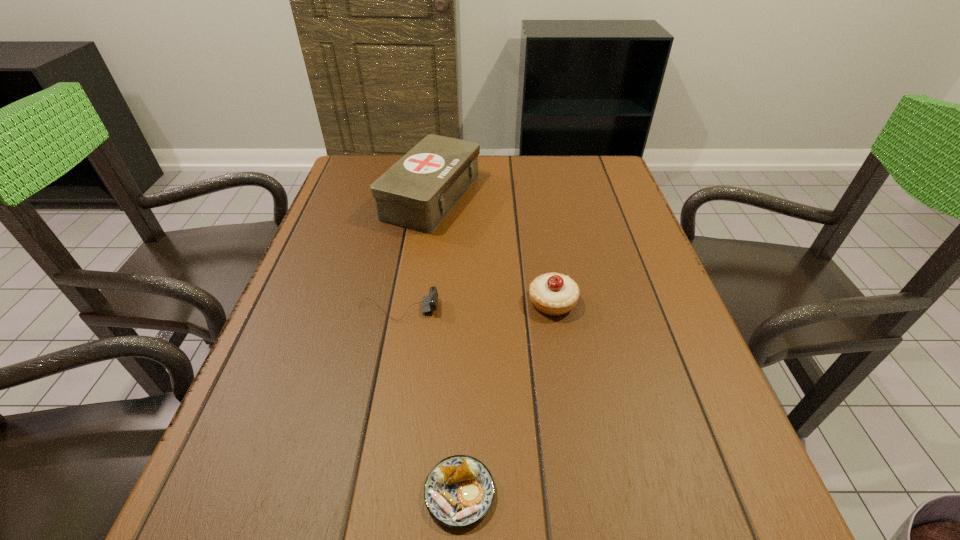
Identify the location of free space between the shorter pastry and the first-aid kit. The image size is (960, 540). (445, 345).

Find the location of a particular element. free space between the tallest object and the left pastry is located at coordinates (445, 345).

Point out which object is positioned as the third nearest to the rightmost object. Please provide its 2D coordinates. Your answer should be formatted as a tuple, i.e. [(x, y)], where the tuple contains the x and y coordinates of a point satisfying the conditions above.

[(459, 491)]

Identify which object is the third closest to the tallest object. Please provide its 2D coordinates. Your answer should be formatted as a tuple, i.e. [(x, y)], where the tuple contains the x and y coordinates of a point satisfying the conditions above.

[(459, 491)]

The height and width of the screenshot is (540, 960). Identify the location of vacant space that satisfies the following two spatial constraints: 1. on the front side of the tallest object; 2. on the front-facing side of the webcam. (415, 309).

Image resolution: width=960 pixels, height=540 pixels. I want to click on vacant space that satisfies the following two spatial constraints: 1. on the front-facing side of the webcam; 2. on the back side of the nearer pastry, so click(x=364, y=493).

The height and width of the screenshot is (540, 960). Find the location of `blank area in the image that satisfies the following two spatial constraints: 1. on the front side of the right pastry; 2. on the left side of the farthest object`. blank area in the image that satisfies the following two spatial constraints: 1. on the front side of the right pastry; 2. on the left side of the farthest object is located at coordinates (416, 302).

This screenshot has height=540, width=960. I want to click on vacant space that satisfies the following two spatial constraints: 1. on the front side of the rightmost object; 2. on the front-facing side of the webcam, so click(554, 309).

This screenshot has width=960, height=540. What are the coordinates of `free space that satisfies the following two spatial constraints: 1. on the front side of the first-aid kit; 2. on the front-facing side of the webcam` in the screenshot? It's located at (415, 309).

The width and height of the screenshot is (960, 540). Find the location of `vacant position in the image that satisfies the following two spatial constraints: 1. on the front-facing side of the webcam; 2. on the left side of the left pastry`. vacant position in the image that satisfies the following two spatial constraints: 1. on the front-facing side of the webcam; 2. on the left side of the left pastry is located at coordinates (364, 493).